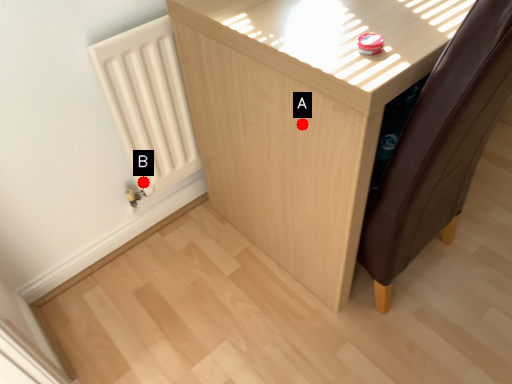
Question: Two points are circled on the image, labeled by A and B beside each circle. Which point is closer to the camera?

Choices:
 (A) A is closer
 (B) B is closer

Answer: (A)